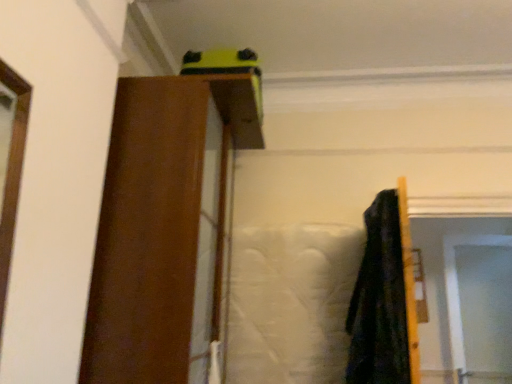
Question: Is transparent plastic screen door at upper right at the left side of brown wood barn door at upper center?

Choices:
 (A) no
 (B) yes

Answer: (A)

Question: Is transparent plastic screen door at upper right taller than brown wood barn door at upper center?

Choices:
 (A) no
 (B) yes

Answer: (A)

Question: Can you confirm if transparent plastic screen door at upper right is shorter than brown wood barn door at upper center?

Choices:
 (A) no
 (B) yes

Answer: (B)

Question: Is transparent plastic screen door at upper right bigger than brown wood barn door at upper center?

Choices:
 (A) no
 (B) yes

Answer: (A)

Question: Does transparent plastic screen door at upper right come behind brown wood barn door at upper center?

Choices:
 (A) yes
 (B) no

Answer: (A)

Question: Is transparent plastic screen door at upper right positioned in front of brown wood barn door at upper center?

Choices:
 (A) yes
 (B) no

Answer: (B)

Question: From a real-world perspective, is brown wood barn door at upper center under transparent plastic screen door at upper right?

Choices:
 (A) yes
 (B) no

Answer: (B)

Question: Can you confirm if brown wood barn door at upper center is taller than transparent plastic screen door at upper right?

Choices:
 (A) yes
 (B) no

Answer: (A)

Question: From the image's perspective, is brown wood barn door at upper center over transparent plastic screen door at upper right?

Choices:
 (A) yes
 (B) no

Answer: (A)

Question: From the image's perspective, is brown wood barn door at upper center located beneath transparent plastic screen door at upper right?

Choices:
 (A) no
 (B) yes

Answer: (A)

Question: Can you confirm if brown wood barn door at upper center is wider than transparent plastic screen door at upper right?

Choices:
 (A) yes
 (B) no

Answer: (A)

Question: Is transparent plastic screen door at upper right inside brown wood barn door at upper center?

Choices:
 (A) yes
 (B) no

Answer: (B)

Question: Relative to transparent plastic screen door at upper right, is brown wood barn door at upper center in front or behind?

Choices:
 (A) behind
 (B) front

Answer: (B)